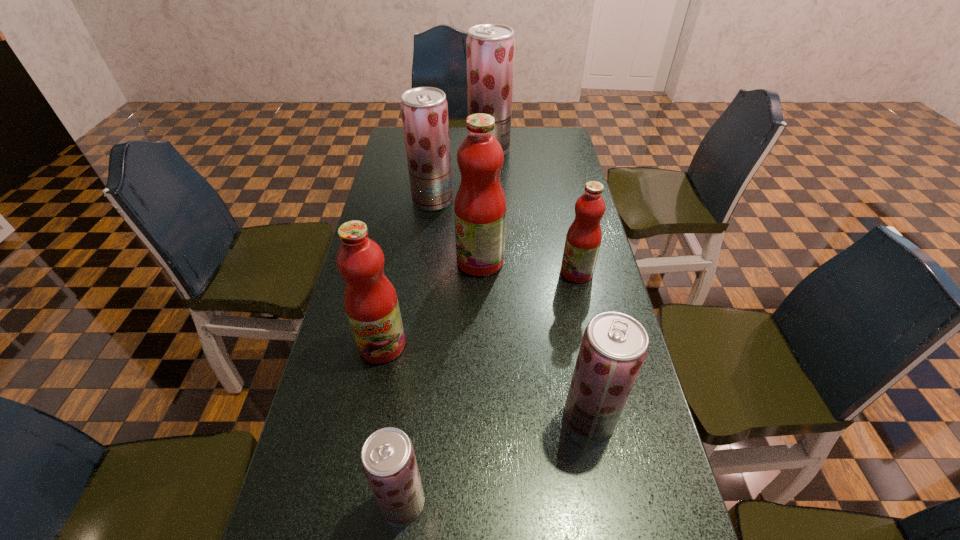
Identify the location of free space located on the front label of the smallest pink fruit juice. 534,272.

Where is `free space located on the left of the second smallest strawberry fruit juice`? The height and width of the screenshot is (540, 960). free space located on the left of the second smallest strawberry fruit juice is located at coordinates (450, 418).

The height and width of the screenshot is (540, 960). In order to click on free spot located 0.200m on the right of the nearest strawberry fruit juice in this screenshot , I will do `click(528, 502)`.

Locate an element on the screen. Image resolution: width=960 pixels, height=540 pixels. object that is at the far edge is located at coordinates (490, 48).

Where is `vacant space at the far edge of the desktop`? This screenshot has height=540, width=960. vacant space at the far edge of the desktop is located at coordinates (450, 128).

Locate an element on the screen. This screenshot has height=540, width=960. free space at the left edge of the desktop is located at coordinates (351, 418).

Find the location of a particular element. free region at the right edge is located at coordinates (x=578, y=174).

The image size is (960, 540). In order to click on blank area at the far left corner in this screenshot , I will do (401, 132).

Locate an element on the screen. free spot at the far right corner of the desktop is located at coordinates (559, 155).

Identify the location of free spot between the second nearest object and the sixth nearest object. This screenshot has width=960, height=540. (511, 309).